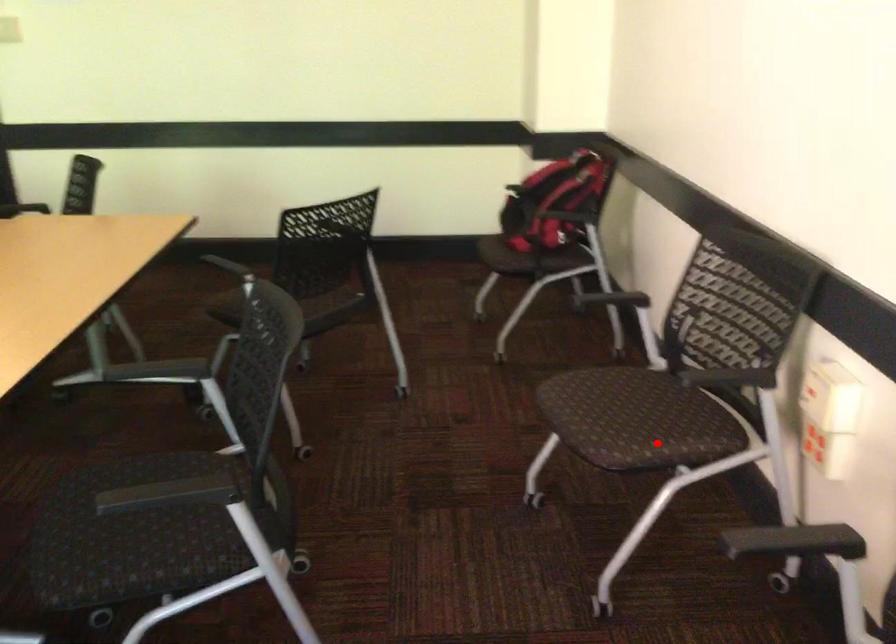
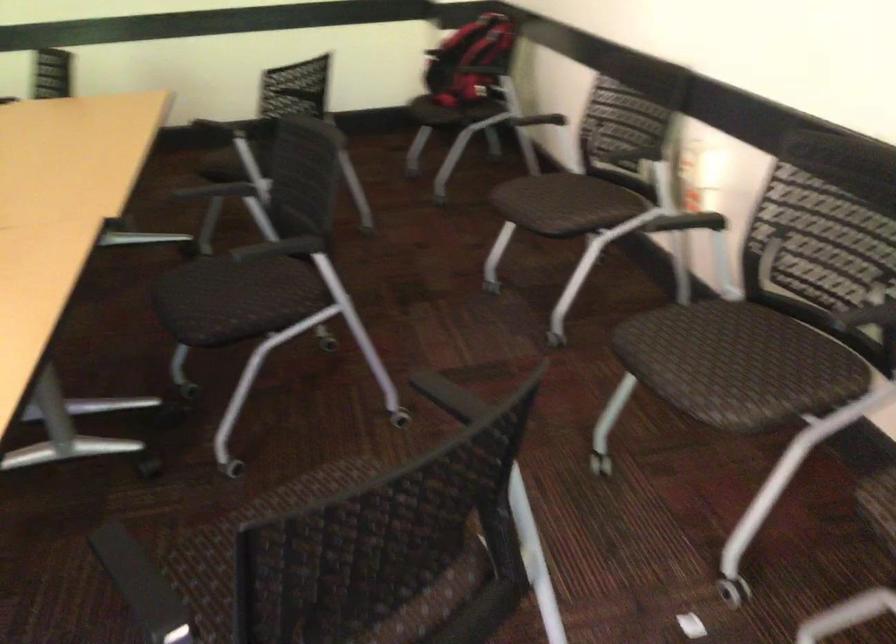
In the second image, find the point that corresponds to the highlighted location in the first image.

(581, 207)